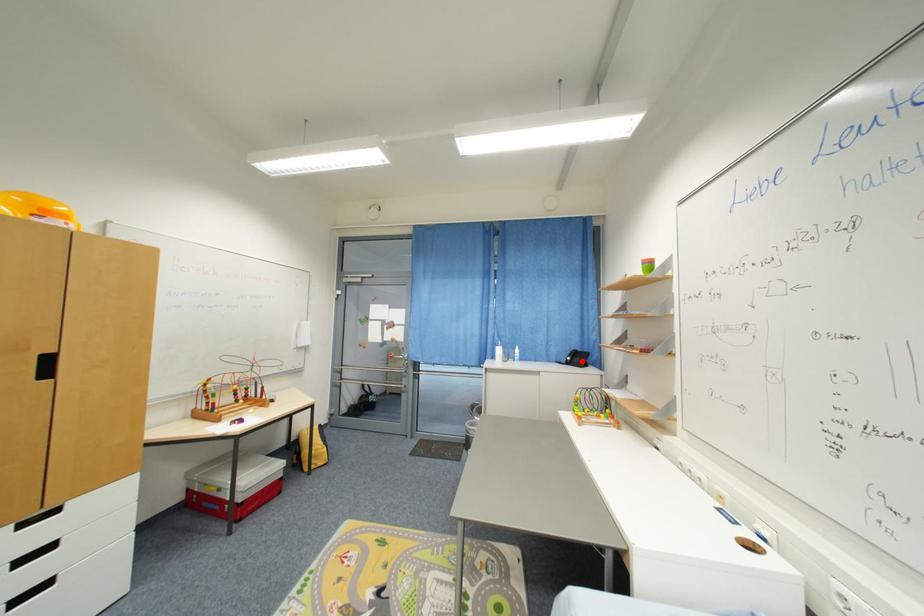
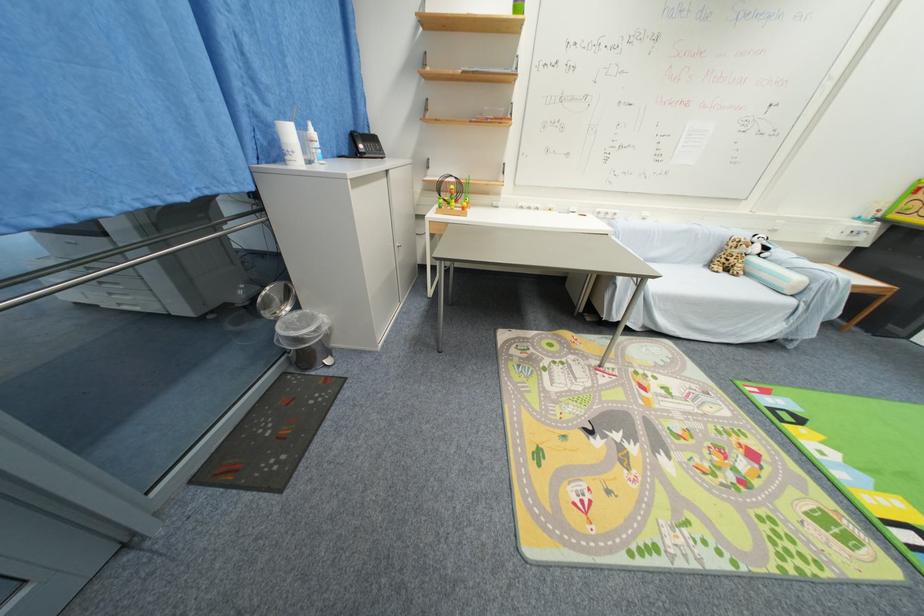
In the second image, find the point that corresponds to the highlighted location in the first image.

(377, 148)